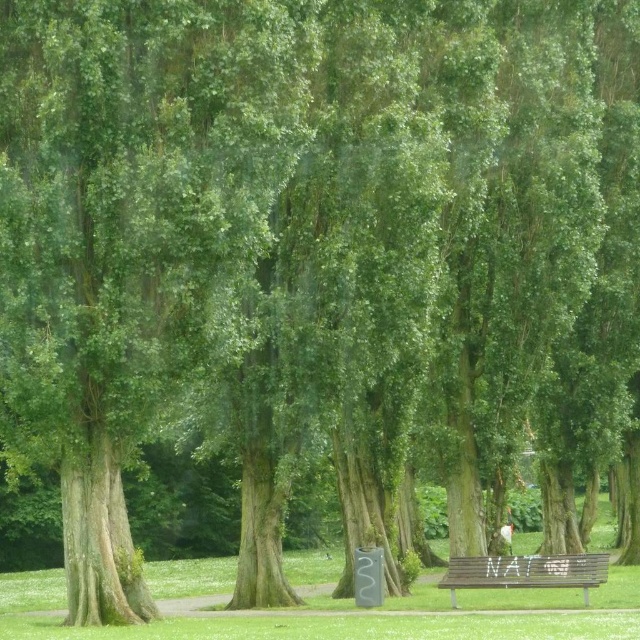
You are planning to set up a picnic in the park. You see the green grass at lower center and the wooden bench at lower center. Which area would provide more space for spreading out a picnic blanket?

The green grass at lower center is bigger than the wooden bench at lower center, so it would provide more space for spreading out a picnic blanket.